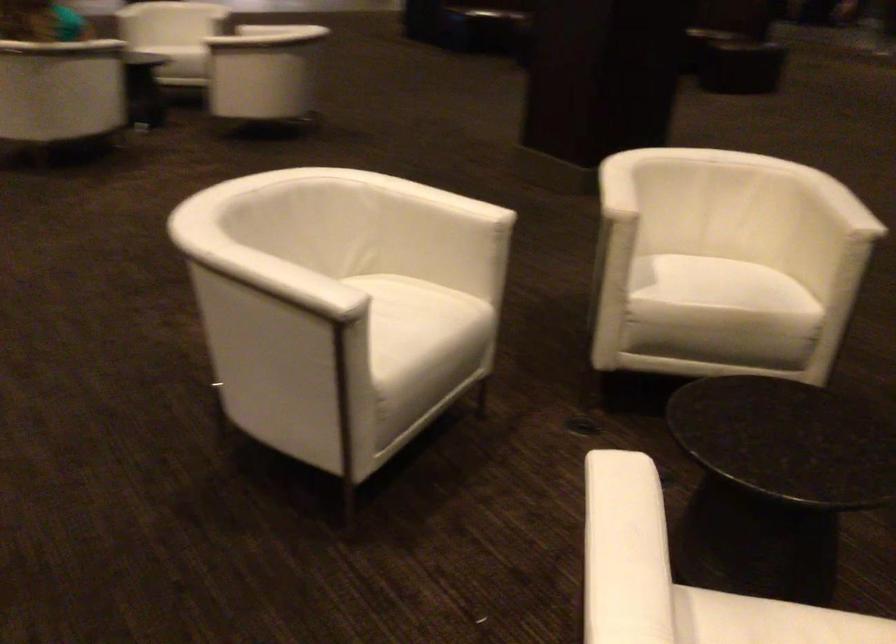
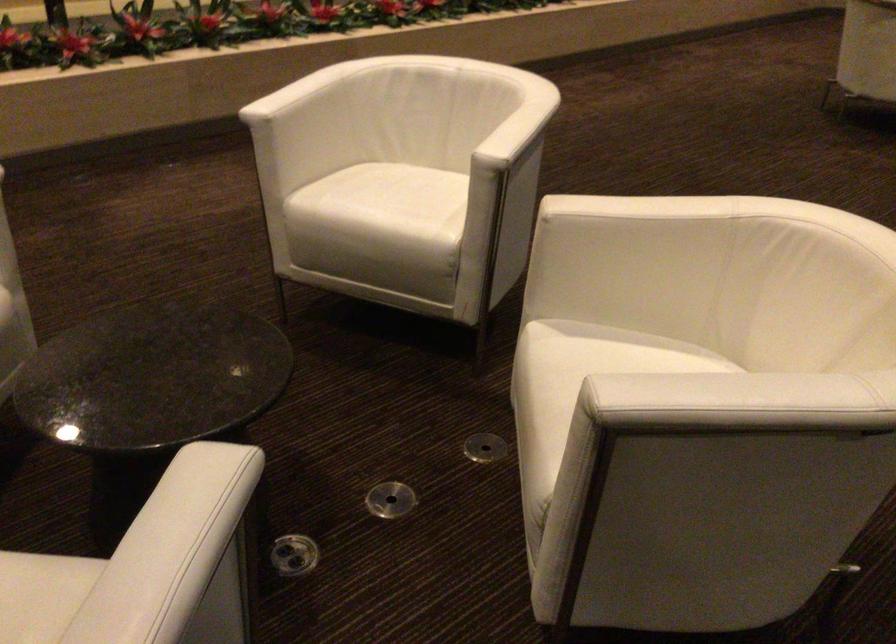
The point at (x=702, y=279) is marked in the first image. Where is the corresponding point in the second image?

(581, 366)